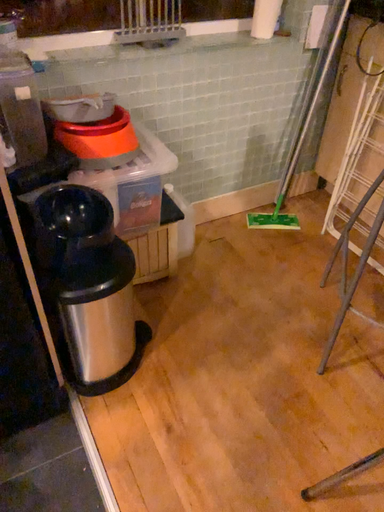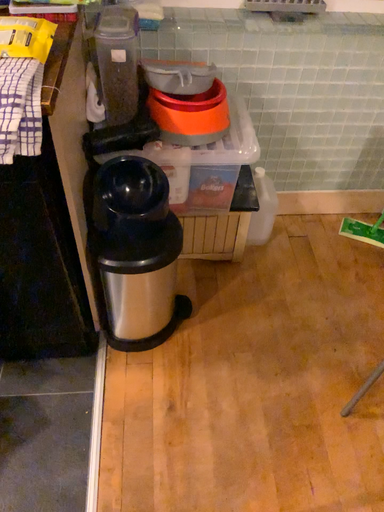
Question: How did the camera likely rotate when shooting the video?

Choices:
 (A) rotated left
 (B) rotated right

Answer: (A)